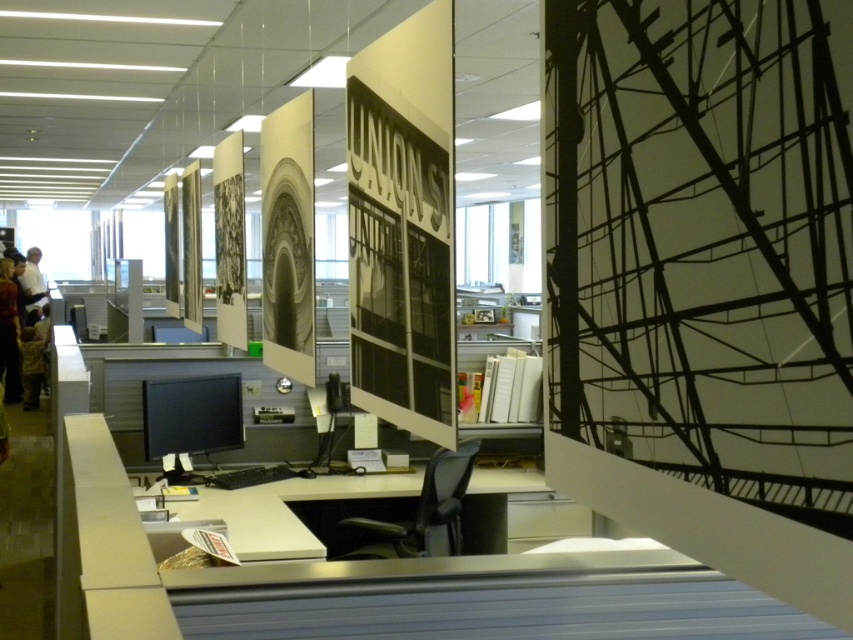
You are standing in front of the desk in the office scene. Where is the metallic silver sign at center located in relation to the desk?

The metallic silver sign at center is located at the center of the desk, positioned at coordinates approximately 0.414 on the x and 0.469 on the y axis.